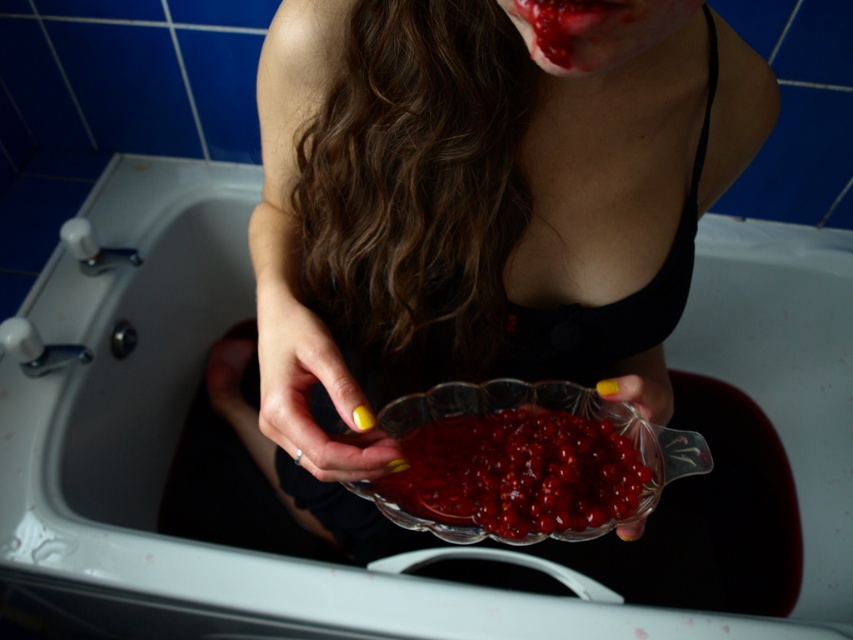
Where is `glossy glass bowl at center`? The width and height of the screenshot is (853, 640). glossy glass bowl at center is located at coordinates (517, 476).

Where is `glossy glass bowl at center`? glossy glass bowl at center is located at coordinates (517, 476).

Which is behind, point (263, 394) or point (567, 33)?

The point (263, 394) is behind.

Is yellow matte nail polish at center below glossy plastic mouth at upper center?

Yes.

Which is in front, point (299, 397) or point (610, 29)?

Point (610, 29) is in front.

At what (x,y) coordinates should I click in order to perform the action: click on yellow matte nail polish at center. Please return your answer as a coordinate pair (x, y). Looking at the image, I should click on (309, 390).

Between transparent glass bowl at center and glossy plastic mouth at upper center, which one appears on the left side from the viewer's perspective?

From the viewer's perspective, transparent glass bowl at center appears more on the left side.

Is transparent glass bowl at center to the left of glossy plastic mouth at upper center from the viewer's perspective?

Indeed, transparent glass bowl at center is positioned on the left side of glossy plastic mouth at upper center.

Which is behind, point (355, 429) or point (573, 26)?

The point (355, 429) is behind.

Find the location of `transparent glass bowl at center`. transparent glass bowl at center is located at coordinates (453, 188).